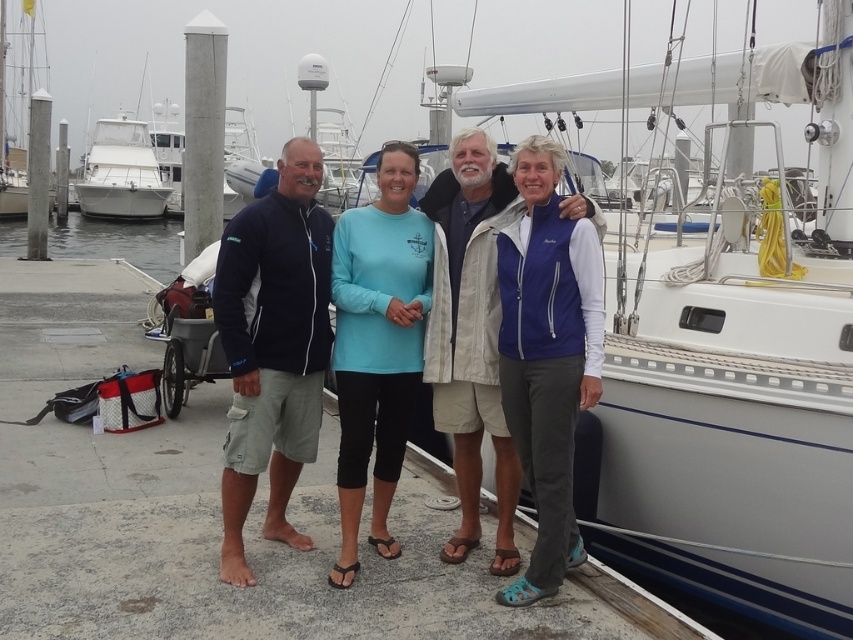
Is white glossy sailboat at right closer to the viewer compared to navy blue fleece jacket at left?

No, it is not.

Does point (689, 541) come in front of point (247, 477)?

No, it is behind (247, 477).

You are a GUI agent. You are given a task and a screenshot of the screen. Output one action in this format:
    pyautogui.click(x=<x>, y=<y>)
    Task: Click on the white glossy sailboat at right
    The width and height of the screenshot is (853, 640).
    Given the screenshot: What is the action you would take?
    click(729, 339)

Based on the photo, can you confirm if matte blue jacket at center is positioned above white glossy boat at upper left?

No, matte blue jacket at center is not above white glossy boat at upper left.

Does matte blue jacket at center have a greater width compared to white glossy boat at upper left?

No, matte blue jacket at center is not wider than white glossy boat at upper left.

The width and height of the screenshot is (853, 640). Identify the location of matte blue jacket at center. (467, 269).

The width and height of the screenshot is (853, 640). Identify the location of matte blue jacket at center. (467, 269).

Is matte blue jacket at center smaller than clear water at dock left?

Indeed, matte blue jacket at center has a smaller size compared to clear water at dock left.

Does matte blue jacket at center lie behind clear water at dock left?

No, matte blue jacket at center is closer to the viewer.

Is point (457, 180) less distant than point (0, 241)?

Yes, point (457, 180) is in front of point (0, 241).

Identify the location of matte blue jacket at center. This screenshot has height=640, width=853. (467, 269).